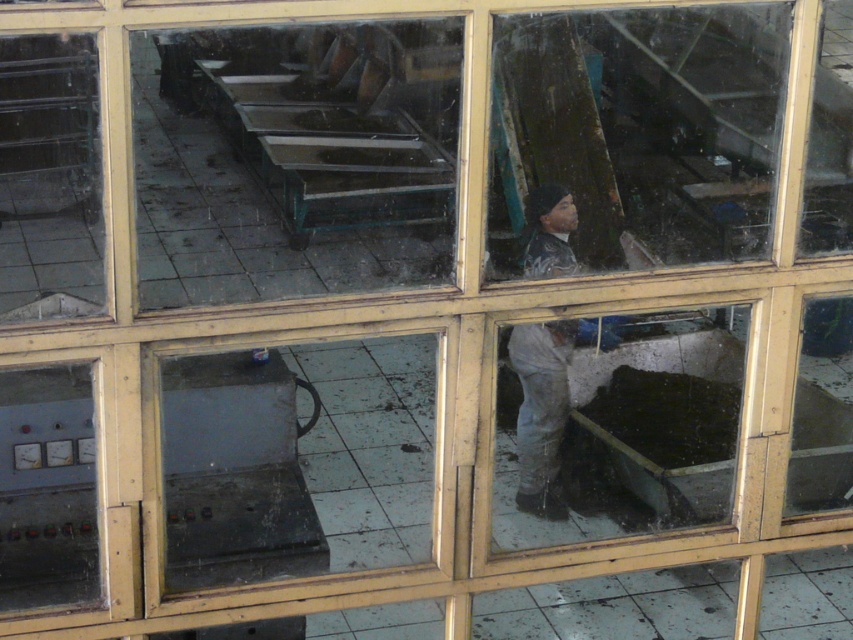
Question: Which object appears closest to the camera in this image?

Choices:
 (A) gray fabric worker at center
 (B) transparent glass table at upper left

Answer: (A)

Question: Which point is closer to the camera taking this photo?

Choices:
 (A) (173, 136)
 (B) (549, 236)

Answer: (B)

Question: Is transparent glass table at upper left below gray fabric worker at center?

Choices:
 (A) no
 (B) yes

Answer: (A)

Question: Does transparent glass table at upper left appear over gray fabric worker at center?

Choices:
 (A) yes
 (B) no

Answer: (A)

Question: Does transparent glass table at upper left have a greater width compared to gray fabric worker at center?

Choices:
 (A) yes
 (B) no

Answer: (A)